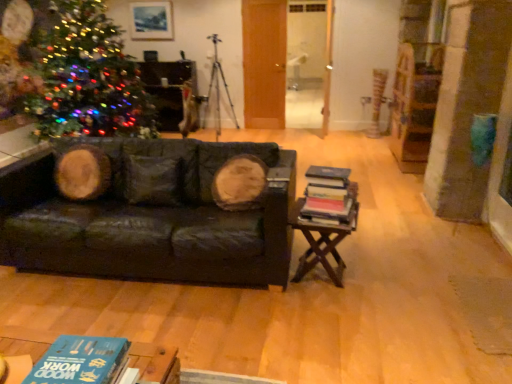
In order to face blue matte book at lower left, the 1th book from the bottom, should I rotate leftwards or rightwards?

Turn left approximately 21.635 degrees to face it.

Image resolution: width=512 pixels, height=384 pixels. I want to click on multicolored lights at left, so click(x=86, y=78).

What is the approximate width of multicolored lights at left?

It is 5.37 feet.

What is the approximate width of hardcover books at right, which is counted as the first book, starting from the right?

hardcover books at right, which is counted as the first book, starting from the right, is 8.95 inches wide.

Locate an element on the screen. Image resolution: width=512 pixels, height=384 pixels. blue matte book at lower left, placed as the 1th book when sorted from left to right is located at coordinates (81, 361).

Is matte wooden picture frame at upper center at the left side of dark green leather couch at center?

Correct, you'll find matte wooden picture frame at upper center to the left of dark green leather couch at center.

Is matte wooden picture frame at upper center facing away from dark green leather couch at center?

No.

Where is `picture frame above the dark green leather couch at center (from a real-world perspective)`? This screenshot has width=512, height=384. picture frame above the dark green leather couch at center (from a real-world perspective) is located at coordinates (151, 21).

Considering the positions of points (119, 53) and (304, 222), is point (119, 53) closer to camera compared to point (304, 222)?

No, it is behind (304, 222).

Does multicolored lights at left have a larger size compared to wooden at right?

Indeed, multicolored lights at left has a larger size compared to wooden at right.

Would you say multicolored lights at left is to the left or to the right of wooden at right in the picture?

multicolored lights at left is to the left of wooden at right.

Is multicolored lights at left wider than matte wooden picture frame at upper center?

Yes.

Is point (39, 64) farther from viewer compared to point (158, 6)?

No.

From the image's perspective, which one is positioned lower, multicolored lights at left or matte wooden picture frame at upper center?

multicolored lights at left is shown below in the image.

Considering the positions of objects hardcover books at right, arranged as the first book when viewed from the back, and wooden at right in the image provided, who is more to the right, hardcover books at right, arranged as the first book when viewed from the back, or wooden at right?

From the viewer's perspective, wooden at right appears more on the right side.

How distant is hardcover books at right, which is counted as the first book, starting from the right, from wooden at right?

hardcover books at right, which is counted as the first book, starting from the right, is 17.57 centimeters from wooden at right.

You are a GUI agent. You are given a task and a screenshot of the screen. Output one action in this format:
    pyautogui.click(x=<x>, y=<y>)
    Task: Click on the table lying on the right of hardcover books at right, which ranks as the second book in front-to-back order
    This screenshot has width=512, height=384.
    Given the screenshot: What is the action you would take?
    pyautogui.click(x=323, y=239)

Considering the relative sizes of hardcover books at right, the 1th book positioned from the top, and wooden at right in the image provided, is hardcover books at right, the 1th book positioned from the top, bigger than wooden at right?

No, hardcover books at right, the 1th book positioned from the top, is not bigger than wooden at right.

How many degrees apart are the facing directions of dark green leather couch at center and wooden at right?

6.09 degrees separate the facing orientations of dark green leather couch at center and wooden at right.

In terms of size, does dark green leather couch at center appear bigger or smaller than wooden at right?

In the image, dark green leather couch at center appears to be larger than wooden at right.

Does point (255, 270) come behind point (337, 243)?

No, (255, 270) is closer to viewer.

In order to click on studio couch to the left of wooden at right in this screenshot , I will do click(x=152, y=215).

Is multicolored lights at left positioned far away from blue matte book at lower left, the 2th book from the top?

multicolored lights at left is far away from blue matte book at lower left, the 2th book from the top.

Which is more to the left, multicolored lights at left or blue matte book at lower left, placed as the 1th book when sorted from left to right?

Positioned to the left is multicolored lights at left.

Is multicolored lights at left oriented towards blue matte book at lower left, the 1th book from the bottom?

No, multicolored lights at left is not aimed at blue matte book at lower left, the 1th book from the bottom.

From the image's perspective, which one is positioned higher, multicolored lights at left or blue matte book at lower left, the 1th book from the bottom?

From the image's view, multicolored lights at left is above.

From a real-world perspective, is hardcover books at right, acting as the 2th book starting from the left, beneath metallic tripod at center?

Correct, in the physical world, hardcover books at right, acting as the 2th book starting from the left, is lower than metallic tripod at center.

Which object is closer to the camera, hardcover books at right, the 2th book when ordered from bottom to top, or metallic tripod at center?

hardcover books at right, the 2th book when ordered from bottom to top, is more forward.

Which is in front, point (344, 219) or point (218, 84)?

The point (344, 219) is closer.

Locate an element on the screen. The image size is (512, 384). tripod behind the hardcover books at right, acting as the 2th book starting from the left is located at coordinates (217, 89).

The image size is (512, 384). I want to click on picture frame lying on the left of dark green leather couch at center, so click(x=151, y=21).

At what (x,y) coordinates should I click in order to perform the action: click on table in front of the multicolored lights at left. Please return your answer as a coordinate pair (x, y). The width and height of the screenshot is (512, 384). Looking at the image, I should click on (323, 239).

Based on their spatial positions, is metallic tripod at center or blue matte book at lower left, placed as the 1th book when sorted from front to back, closer to wooden at right?

blue matte book at lower left, placed as the 1th book when sorted from front to back, lies closer to wooden at right than the other object.

Looking at the image, which one is located further to matte wooden picture frame at upper center, hardcover books at right, arranged as the first book when viewed from the back, or wooden at right?

hardcover books at right, arranged as the first book when viewed from the back, lies further to matte wooden picture frame at upper center than the other object.

Which object lies nearer to the anchor point matte wooden picture frame at upper center, wooden at right or blue matte book at lower left, the 1th book from the bottom?

wooden at right.

Based on their spatial positions, is wooden at right or hardcover books at right, which ranks as the second book in front-to-back order, closer to blue matte book at lower left, placed as the 1th book when sorted from left to right?

hardcover books at right, which ranks as the second book in front-to-back order, is closer to blue matte book at lower left, placed as the 1th book when sorted from left to right.

Based on their spatial positions, is matte wooden picture frame at upper center or wooden at right further from blue matte book at lower left, which appears as the second book when viewed from the back?

Based on the image, matte wooden picture frame at upper center appears to be further to blue matte book at lower left, which appears as the second book when viewed from the back.

Considering their positions, is hardcover books at right, which ranks as the second book in front-to-back order, positioned closer to matte wooden picture frame at upper center than blue matte book at lower left, placed as the 1th book when sorted from left to right?

hardcover books at right, which ranks as the second book in front-to-back order, lies closer to matte wooden picture frame at upper center than the other object.

Looking at the image, which one is located closer to blue matte book at lower left, marked as the second book in a right-to-left arrangement, hardcover books at right, the 2th book when ordered from bottom to top, or wooden at right?

hardcover books at right, the 2th book when ordered from bottom to top, is positioned closer to the anchor blue matte book at lower left, marked as the second book in a right-to-left arrangement.

Looking at the image, which one is located further to multicolored lights at left, dark green leather couch at center or blue matte book at lower left, the 1th book from the bottom?

Among the two, blue matte book at lower left, the 1th book from the bottom, is located further to multicolored lights at left.

Identify the location of christmas tree between wooden at right and metallic tripod at center from front to back. This screenshot has width=512, height=384. (86, 78).

The width and height of the screenshot is (512, 384). Find the location of `table located between blue matte book at lower left, marked as the second book in a right-to-left arrangement, and matte wooden picture frame at upper center in the depth direction`. table located between blue matte book at lower left, marked as the second book in a right-to-left arrangement, and matte wooden picture frame at upper center in the depth direction is located at coordinates (323, 239).

At what (x,y) coordinates should I click in order to perform the action: click on tripod between multicolored lights at left and matte wooden picture frame at upper center along the z-axis. Please return your answer as a coordinate pair (x, y). Looking at the image, I should click on (217, 89).

The width and height of the screenshot is (512, 384). In order to click on studio couch between blue matte book at lower left, the 2th book from the top, and multicolored lights at left in the front-back direction in this screenshot , I will do `click(152, 215)`.